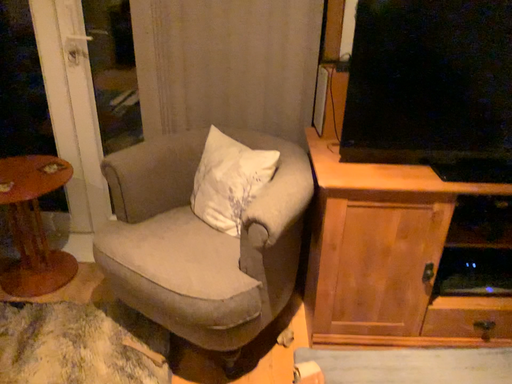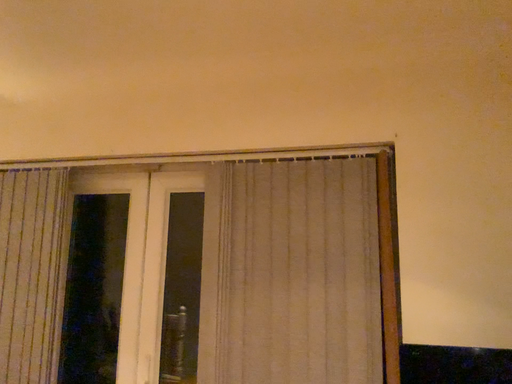
Question: Which way did the camera rotate in the video?

Choices:
 (A) rotated upward
 (B) rotated downward

Answer: (A)